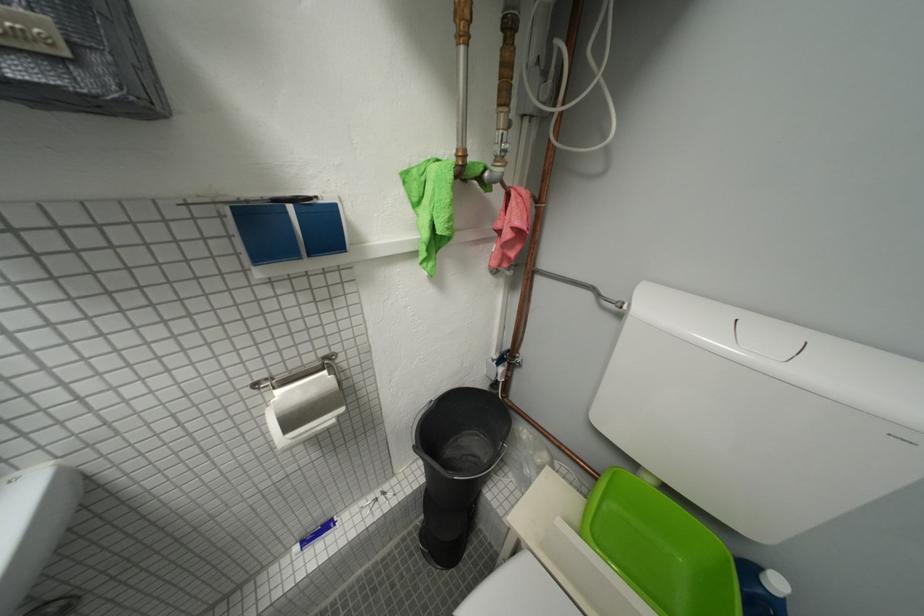
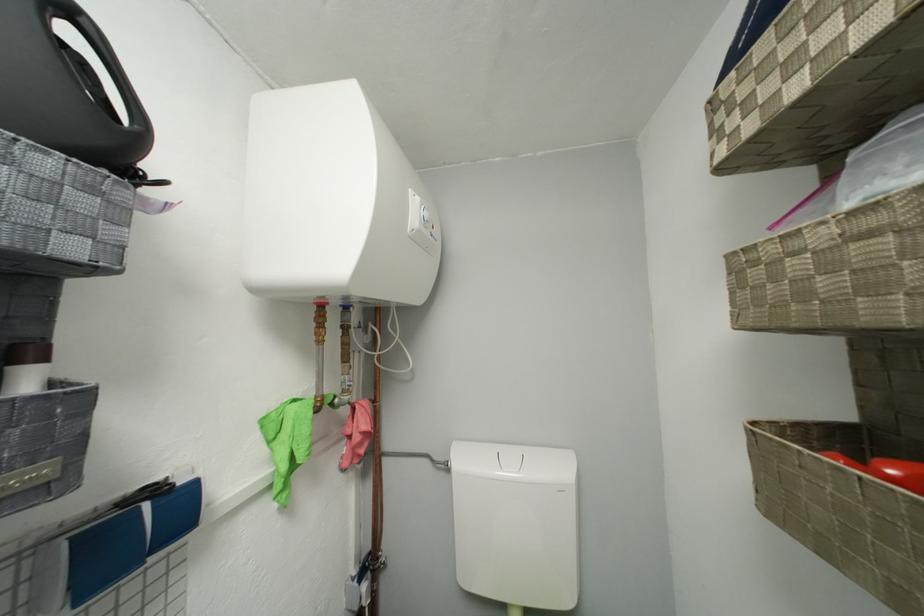
Where in the second image is the point corresponding to the point at 507,228 from the first image?

(358, 435)